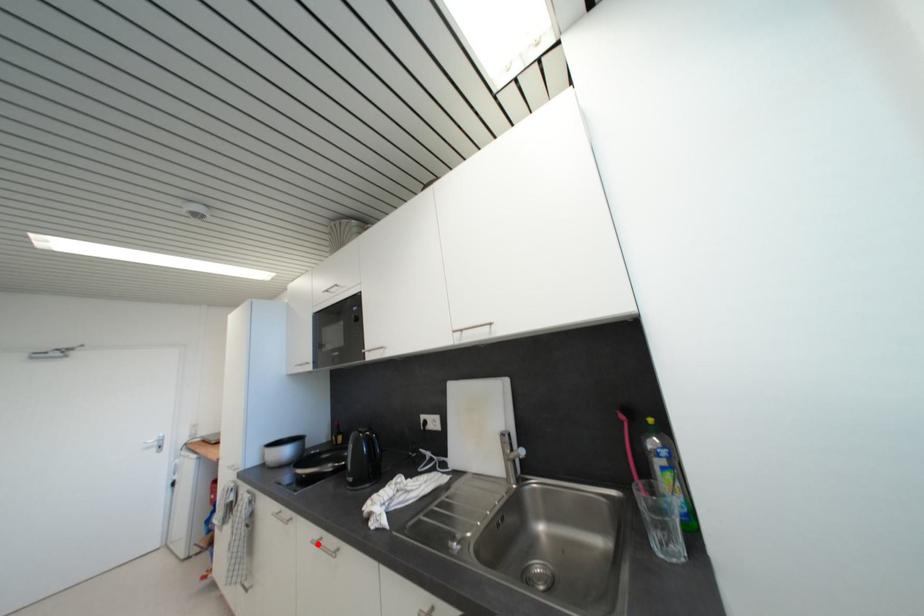
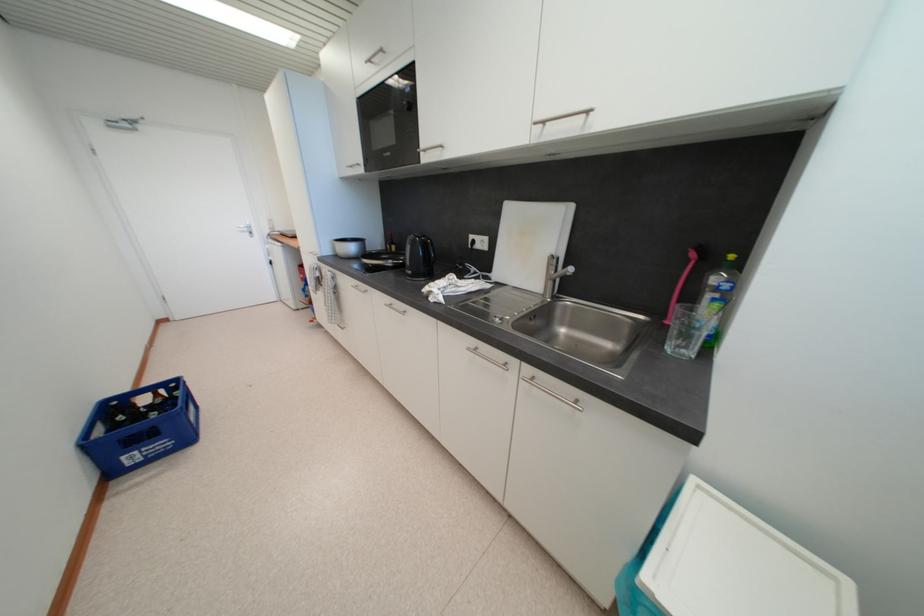
Where in the second image is the point corresponding to the highlighted location from the first image?

(391, 307)